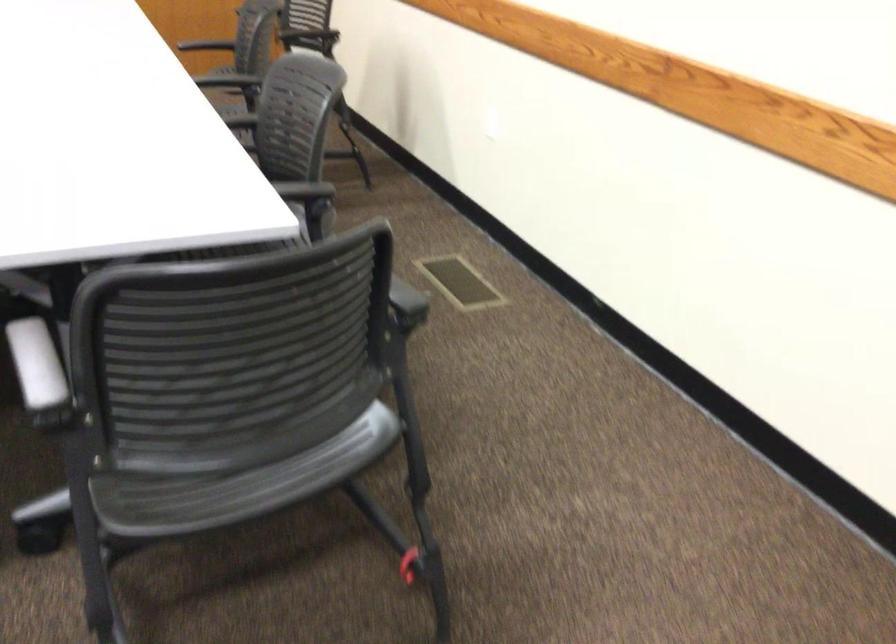
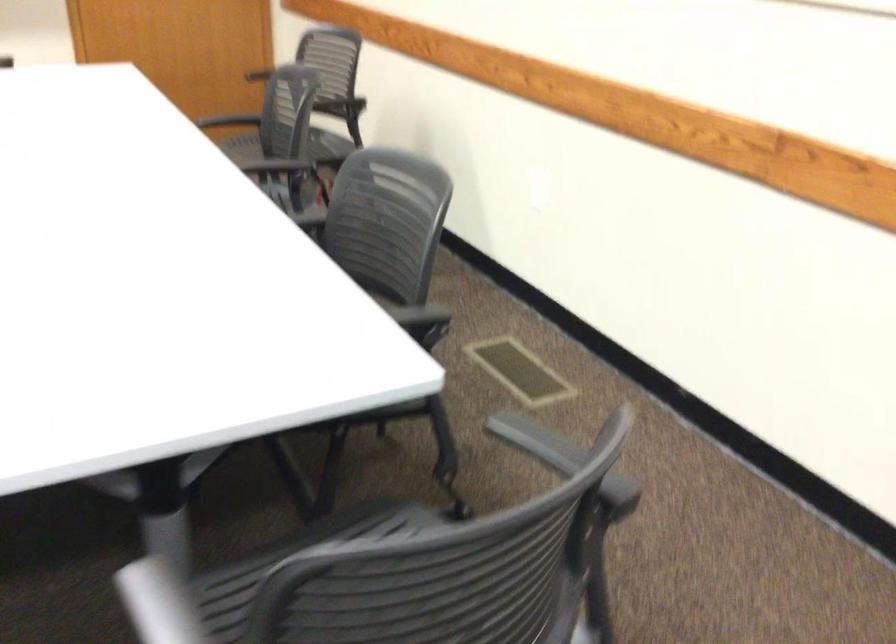
Find the pixel in the second image that matches (x=381, y=279) in the first image.

(563, 458)